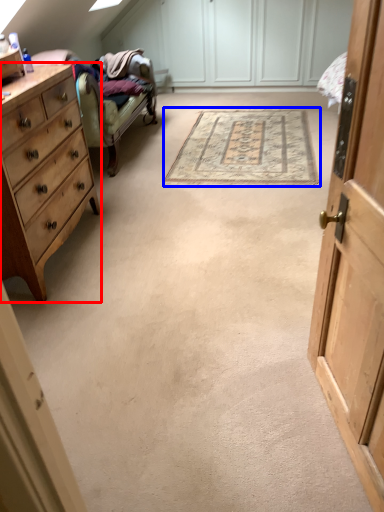
Question: Which point is closer to the camera, chest of drawers (highlighted by a red box) or mat (highlighted by a blue box)?

Choices:
 (A) chest of drawers
 (B) mat

Answer: (A)